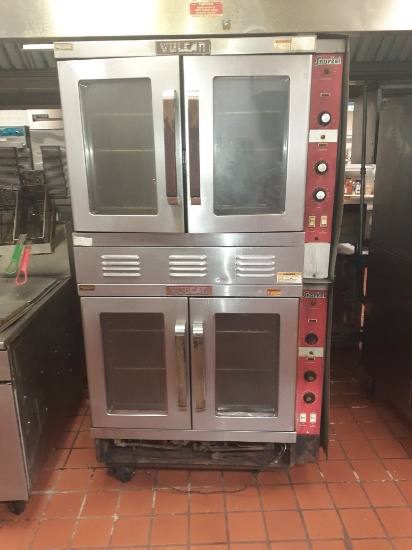
What are the coordinates of `black knobs` in the screenshot? It's located at (312, 338), (308, 377), (307, 398).